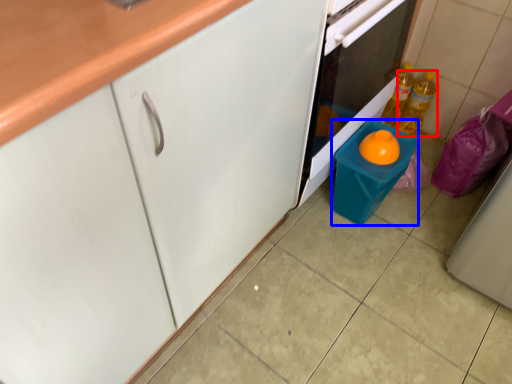
Question: Which point is closer to the camera, bottle (highlighted by a red box) or appliance (highlighted by a blue box)?

Choices:
 (A) bottle
 (B) appliance

Answer: (B)